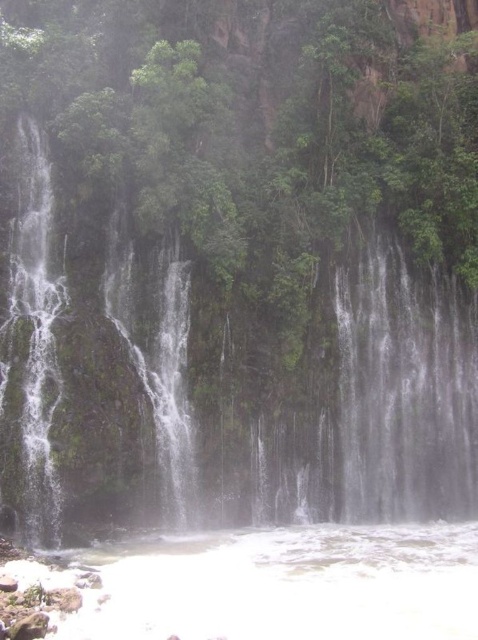
You are standing at the base of the waterfall and notice two points marked in the image. The first point is at coordinates point (145, 413) and the second is at point (141, 625). Which point is closer to you?

Point (141, 625) is closer to you because it is in front of point (145, 413).

You are standing at the edge of the waterfall and see the point marked as point (227, 394). What is the state of the water at this point?

The point (227, 394) marks white frothy water at center, so the water at this point is in a frothy state due to the turbulence caused by the waterfall crashing into the pool below.